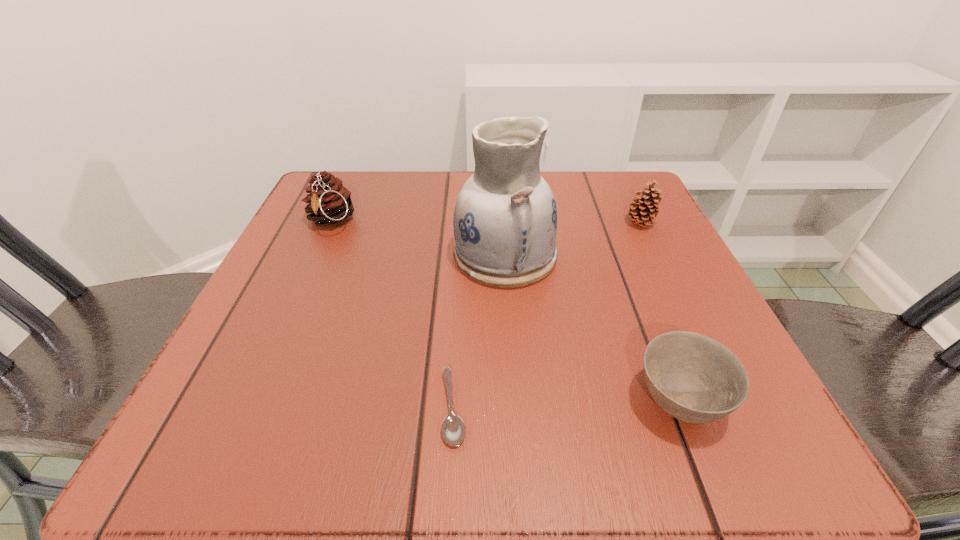
Locate an element on the screen. The height and width of the screenshot is (540, 960). vacant area that lies between the tallest object and the shorter pinecone is located at coordinates (573, 239).

This screenshot has height=540, width=960. In order to click on empty space between the bowl and the left pinecone in this screenshot , I will do `click(505, 312)`.

Locate an element on the screen. free space between the tallest object and the leftmost object is located at coordinates (418, 238).

Find the location of `free space between the right pinecone and the soupspoon`. free space between the right pinecone and the soupspoon is located at coordinates (547, 315).

Select which object appears as the third closest to the shorter pinecone. Please provide its 2D coordinates. Your answer should be formatted as a tuple, i.e. [(x, y)], where the tuple contains the x and y coordinates of a point satisfying the conditions above.

[(453, 429)]

Select which object is the second closest to the tallest object. Please provide its 2D coordinates. Your answer should be formatted as a tuple, i.e. [(x, y)], where the tuple contains the x and y coordinates of a point satisfying the conditions above.

[(694, 378)]

Where is `vacant space that satisfies the following two spatial constraints: 1. on the back side of the second shortest object; 2. on the left side of the shortest object`? vacant space that satisfies the following two spatial constraints: 1. on the back side of the second shortest object; 2. on the left side of the shortest object is located at coordinates (454, 402).

Find the location of a particular element. This screenshot has width=960, height=540. vacant space that satisfies the following two spatial constraints: 1. with a leaf charm attached to the left pinecone; 2. on the left side of the third shortest object is located at coordinates (330, 223).

The image size is (960, 540). I want to click on free location that satisfies the following two spatial constraints: 1. with a leaf charm attached to the bowl; 2. on the right side of the left pinecone, so click(x=249, y=402).

The height and width of the screenshot is (540, 960). In order to click on vacant area that satisfies the following two spatial constraints: 1. on the back side of the pottery; 2. on the left side of the soupspoon in this screenshot , I will do `click(462, 254)`.